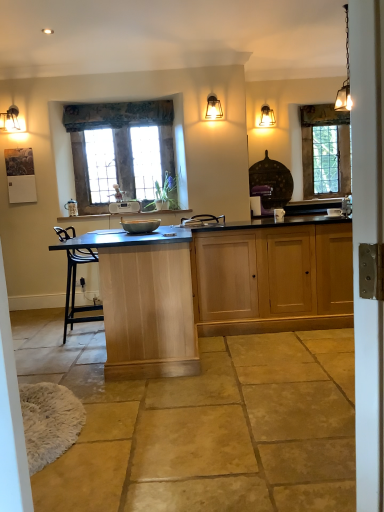
At what (x,y) coordinates should I click in order to perform the action: click on vacant space that's between light wood cabinet at center and light wood table at center. Please return your answer as a coordinate pair (x, y). This screenshot has height=512, width=384. Looking at the image, I should click on (258, 344).